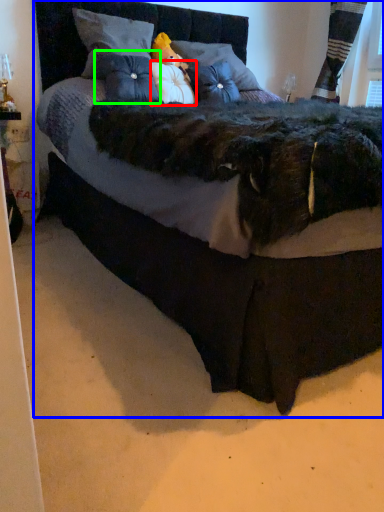
Question: Which object is the farthest from pillow (highlighted by a red box)? Choose among these: bed (highlighted by a blue box) or pillow (highlighted by a green box).

Choices:
 (A) bed
 (B) pillow

Answer: (A)